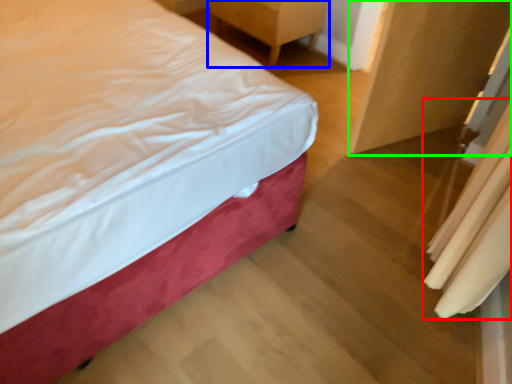
Question: Considering the real-world distances, which object is closest to curtain (highlighted by a red box)? furniture (highlighted by a blue box) or armoire (highlighted by a green box).

Choices:
 (A) furniture
 (B) armoire

Answer: (B)